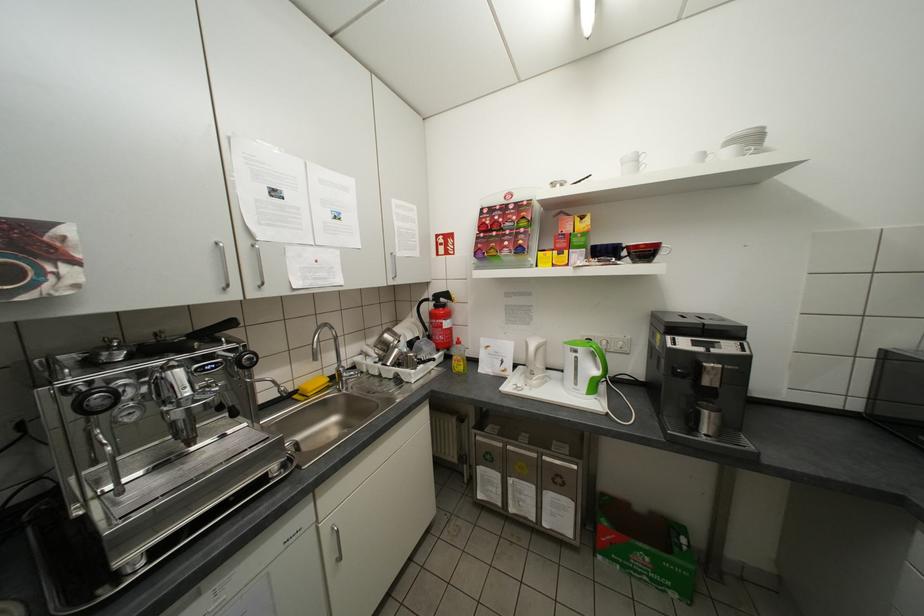
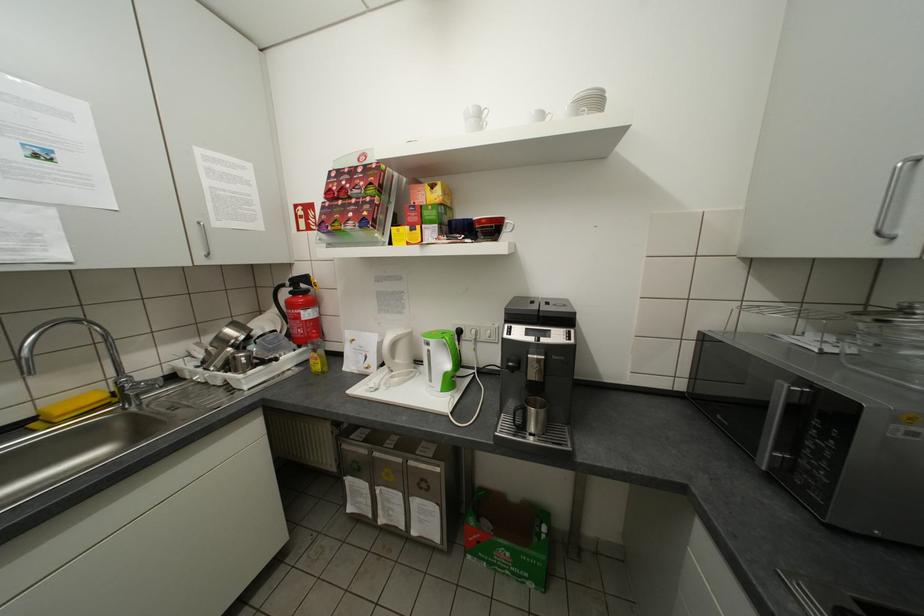
Where in the second image is the point corresponding to point 600,347 from the first image?

(452, 338)